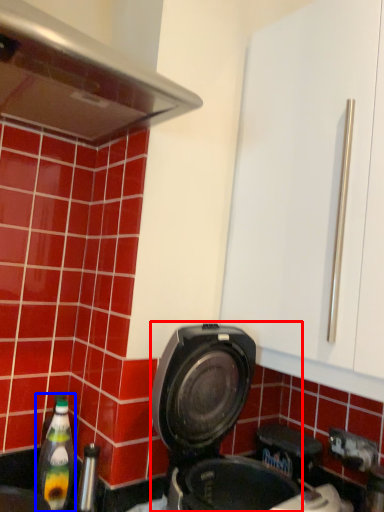
Question: Which point is further to the camera, kitchen appliance (highlighted by a red box) or bottle (highlighted by a blue box)?

Choices:
 (A) kitchen appliance
 (B) bottle

Answer: (B)